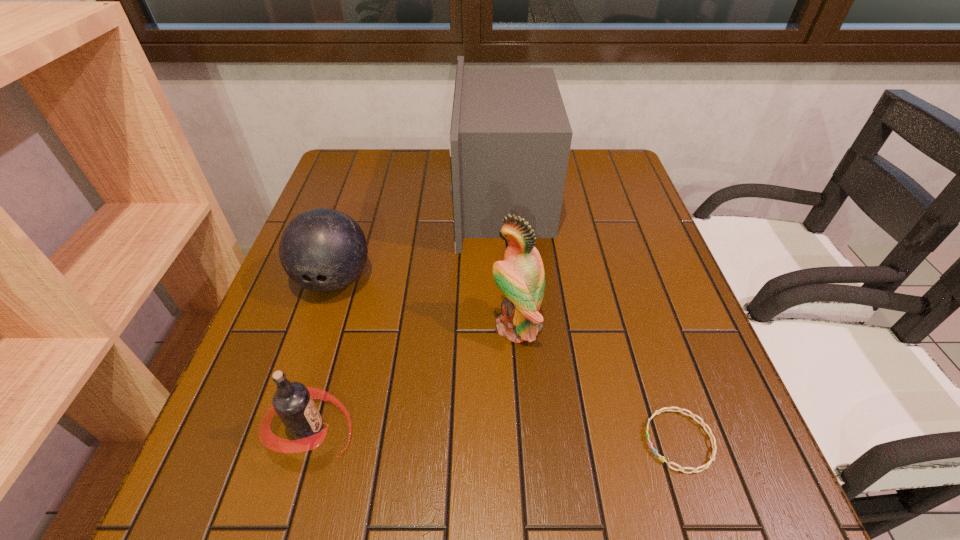
Locate an element on the screen. Image resolution: width=960 pixels, height=540 pixels. bowling ball positioned at the left edge is located at coordinates (323, 250).

Locate an element on the screen. The image size is (960, 540). root beer located in the left edge section of the desktop is located at coordinates (293, 402).

Identify the location of object present at the right edge. Image resolution: width=960 pixels, height=540 pixels. (705, 466).

Find the location of a particular element. object at the near left corner is located at coordinates (293, 402).

Locate an element on the screen. This screenshot has width=960, height=540. object that is at the near right corner is located at coordinates (705, 466).

You are a GUI agent. You are given a task and a screenshot of the screen. Output one action in this format:
    pyautogui.click(x=<x>, y=<y>)
    Task: Click on the vacant space at the far edge
    This screenshot has width=960, height=540.
    Given the screenshot: What is the action you would take?
    pyautogui.click(x=416, y=152)

Identify the location of vacant space at the near edge of the desktop. The width and height of the screenshot is (960, 540). (652, 480).

At what (x,y) coordinates should I click in order to perform the action: click on free spot at the left edge of the desktop. Please return your answer as a coordinate pair (x, y). Image resolution: width=960 pixels, height=540 pixels. Looking at the image, I should click on (x=360, y=211).

I want to click on vacant region at the right edge of the desktop, so click(599, 256).

Locate an element on the screen. The height and width of the screenshot is (540, 960). vacant space at the far left corner is located at coordinates (340, 178).